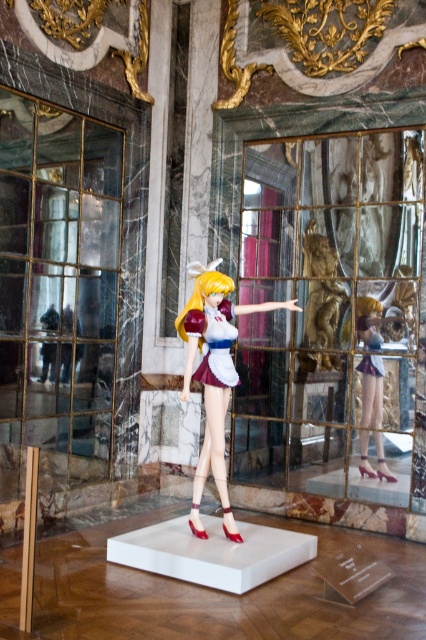
Is point (328, 324) positioned in front of point (359, 470)?

No, (328, 324) is further to viewer.

Is the position of gold metallic statue at center more distant than that of matte plastic doll at center?

Yes, it is behind matte plastic doll at center.

This screenshot has width=426, height=640. What do you see at coordinates (321, 301) in the screenshot? I see `gold metallic statue at center` at bounding box center [321, 301].

Where is `gold metallic statue at center`? The height and width of the screenshot is (640, 426). gold metallic statue at center is located at coordinates (321, 301).

At what (x,y) coordinates should I click in order to perform the action: click on clear glass display case at center. Please return your answer as a coordinate pair (x, y). Image resolution: width=426 pixels, height=640 pixels. Looking at the image, I should click on (330, 314).

Which of these two, clear glass display case at center or gold metallic statue at center, stands taller?

Standing taller between the two is clear glass display case at center.

Which is in front, point (397, 173) or point (333, 272)?

Point (397, 173)

At what (x,y) coordinates should I click in order to perform the action: click on clear glass display case at center. Please return your answer as a coordinate pair (x, y). The width and height of the screenshot is (426, 640). Looking at the image, I should click on (330, 314).

Does satin gold doll at center have a lesser width compared to golden hair at center?

Incorrect, satin gold doll at center's width is not less than golden hair at center's.

Is point (195, 326) more distant than point (201, 292)?

No, (195, 326) is in front of (201, 292).

Between point (218, 307) and point (193, 307), which one is positioned in front?

Point (193, 307) is in front.

This screenshot has height=640, width=426. Find the location of `satin gold doll at center`. satin gold doll at center is located at coordinates (213, 374).